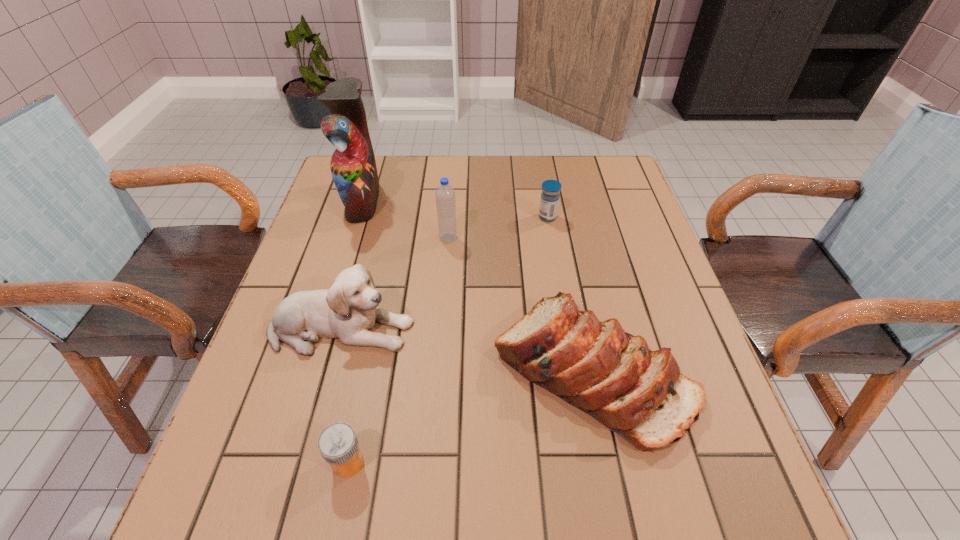
I want to click on object present at the far left corner, so click(353, 167).

Locate an element on the screen. free space at the far edge is located at coordinates click(x=540, y=174).

This screenshot has width=960, height=540. Find the location of `vacant region at the left edge of the desktop`. vacant region at the left edge of the desktop is located at coordinates (259, 426).

I want to click on free spot at the right edge of the desktop, so click(656, 458).

Find the location of a particular element. vacant space at the far left corner of the desktop is located at coordinates pyautogui.click(x=391, y=158).

At what (x,y) coordinates should I click in order to perform the action: click on free space at the near left corner of the desktop. Please return your answer as a coordinate pair (x, y). Looking at the image, I should click on (229, 519).

The width and height of the screenshot is (960, 540). I want to click on vacant area at the far right corner, so click(x=576, y=173).

Locate an element on the screen. The height and width of the screenshot is (540, 960). free point between the fourth nearest object and the puppy is located at coordinates 395,284.

The width and height of the screenshot is (960, 540). In order to click on vacant region between the taller medicine and the puppy in this screenshot , I will do `click(444, 273)`.

You are a GUI agent. You are given a task and a screenshot of the screen. Output one action in this format:
    pyautogui.click(x=<x>, y=<y>)
    Task: Click on the unoccupied area between the puppy and the fourth tallest object
    
    Given the screenshot: What is the action you would take?
    pyautogui.click(x=467, y=350)